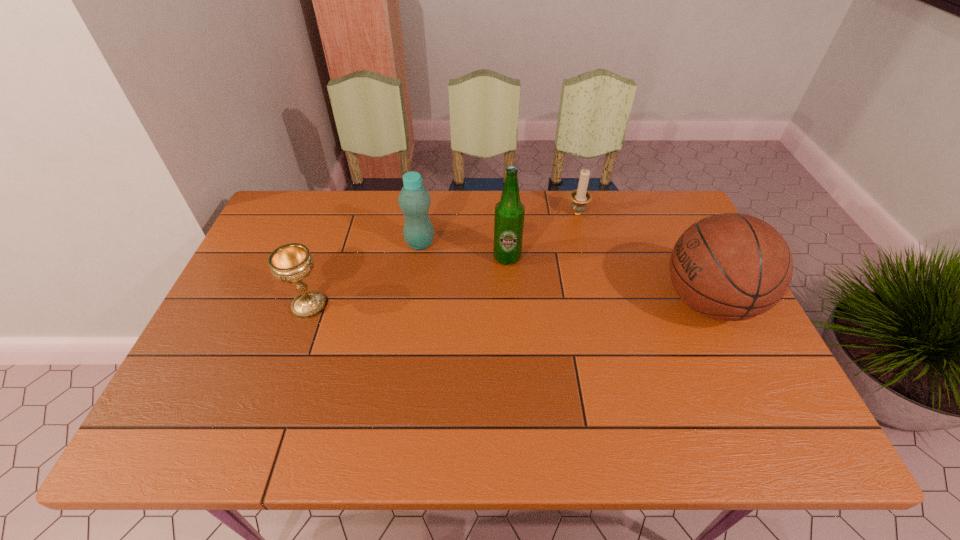
Locate an element on the screen. vacant position in the image that satisfies the following two spatial constraints: 1. on the back side of the leftmost object; 2. on the left side of the beer bottle is located at coordinates (326, 258).

You are a GUI agent. You are given a task and a screenshot of the screen. Output one action in this format:
    pyautogui.click(x=<x>, y=<y>)
    Task: Click on the vacant area that satisfies the following two spatial constraints: 1. on the back side of the farthest object; 2. on the right side of the second object from left to right
    The image size is (960, 540).
    Given the screenshot: What is the action you would take?
    [x=424, y=214]

At what (x,y) coordinates should I click in order to perform the action: click on vacant space that satisfies the following two spatial constraints: 1. on the back side of the leftmost object; 2. on the right side of the beer bottle. Please return your answer as a coordinate pair (x, y). Image resolution: width=960 pixels, height=540 pixels. Looking at the image, I should click on (326, 258).